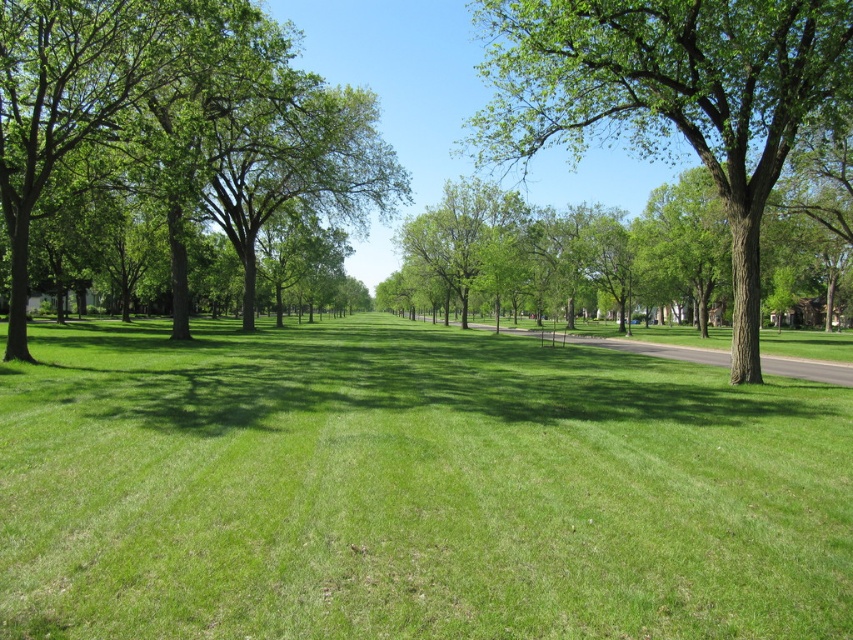
Question: Estimate the real-world distances between objects in this image. Which object is farther from the green leafy tree at left?

Choices:
 (A) green rough bark tree at center
 (B) green grassy field at center

Answer: (A)

Question: Does green grassy field at center have a greater width compared to green leafy tree at left?

Choices:
 (A) no
 (B) yes

Answer: (B)

Question: Does green grassy field at center appear on the right side of green rough bark tree at center?

Choices:
 (A) no
 (B) yes

Answer: (A)

Question: Which of the following is the closest to the observer?

Choices:
 (A) (0, 74)
 (B) (541, 124)
 (C) (732, 540)

Answer: (C)

Question: Can you confirm if green rough bark tree at center is bigger than green leafy tree at left?

Choices:
 (A) yes
 (B) no

Answer: (A)

Question: Which of the following is the closest to the observer?

Choices:
 (A) green rough bark tree at center
 (B) green leafy tree at left

Answer: (A)